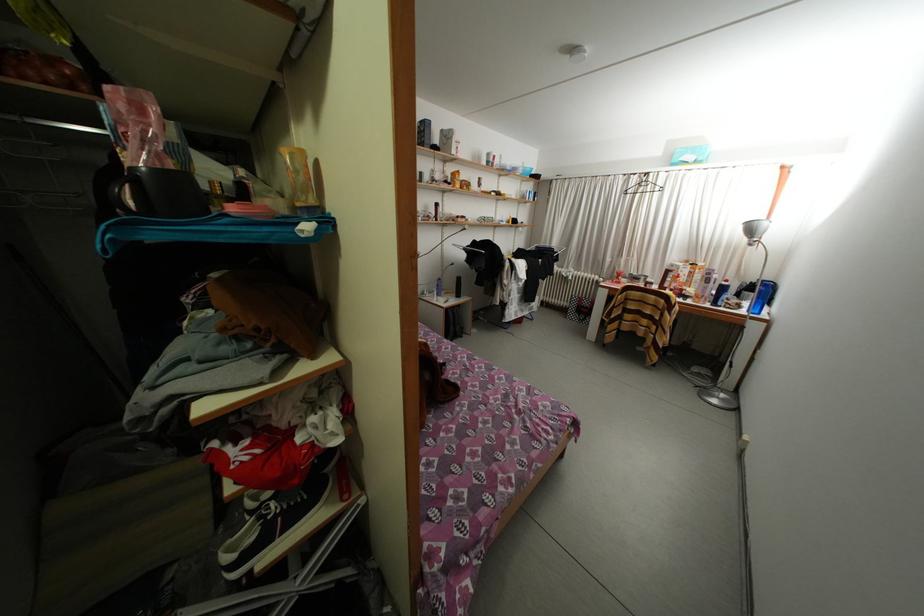
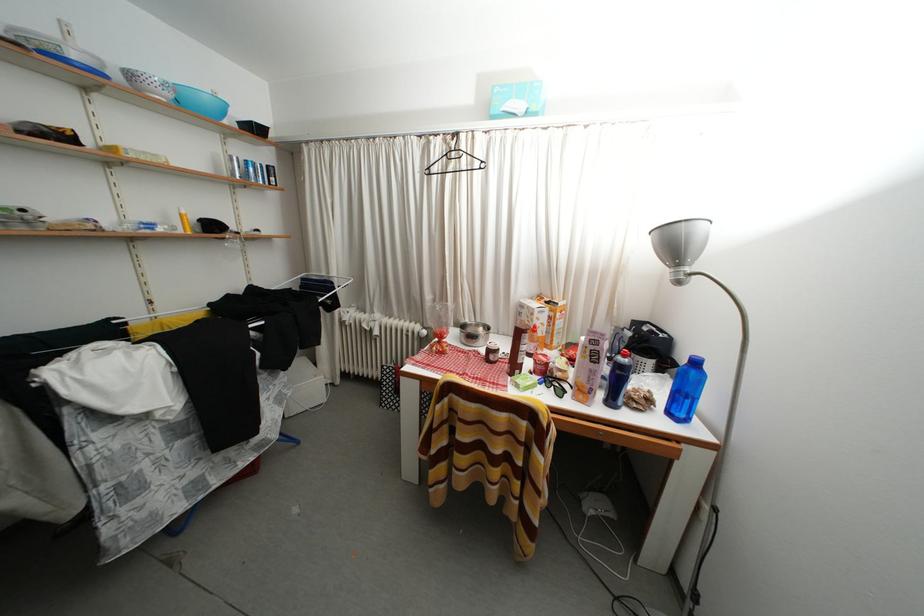
Locate, in the second image, the point that corresponds to (x=723, y=309) in the first image.

(618, 408)